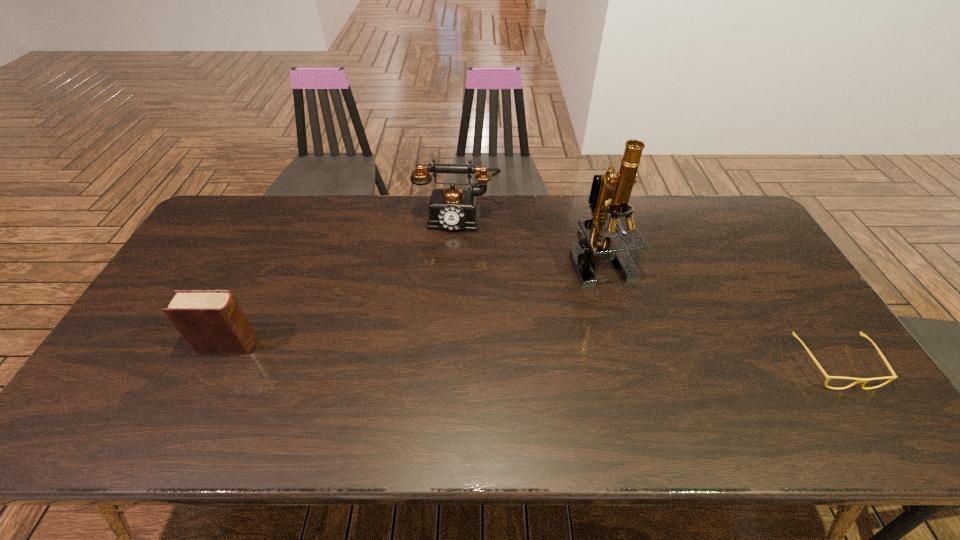
At what (x,y) coordinates should I click in order to perform the action: click on vacant space situated on the front of the telephone at the rotary dial. Please return your answer as a coordinate pair (x, y). This screenshot has width=960, height=540. Looking at the image, I should click on click(x=443, y=307).

Identify the location of vacant region located 0.080m on the front of the telephone at the rotary dial. pos(451,249).

Where is `vacant area located at the eyepiece of the tallest object`? This screenshot has width=960, height=540. vacant area located at the eyepiece of the tallest object is located at coordinates (593, 346).

This screenshot has height=540, width=960. I want to click on vacant region located 0.190m at the eyepiece of the tallest object, so click(x=594, y=337).

You are a GUI agent. You are given a task and a screenshot of the screen. Output one action in this format:
    pyautogui.click(x=<x>, y=<y>)
    Task: Click on the free region located at the eyepiece of the tallest object
    Image resolution: width=960 pixels, height=540 pixels.
    Given the screenshot: What is the action you would take?
    pyautogui.click(x=588, y=396)

Identify the location of telephone at the far edge. (454, 209).

Where is `microscope that is at the far edge`? This screenshot has height=540, width=960. microscope that is at the far edge is located at coordinates (617, 216).

This screenshot has height=540, width=960. In order to click on object that is at the near edge in this screenshot , I will do `click(864, 380)`.

Find the location of a particular element. The image size is (960, 540). object that is at the right edge is located at coordinates (864, 380).

This screenshot has width=960, height=540. What are the coordinates of `object that is at the near right corner` in the screenshot? It's located at (864, 380).